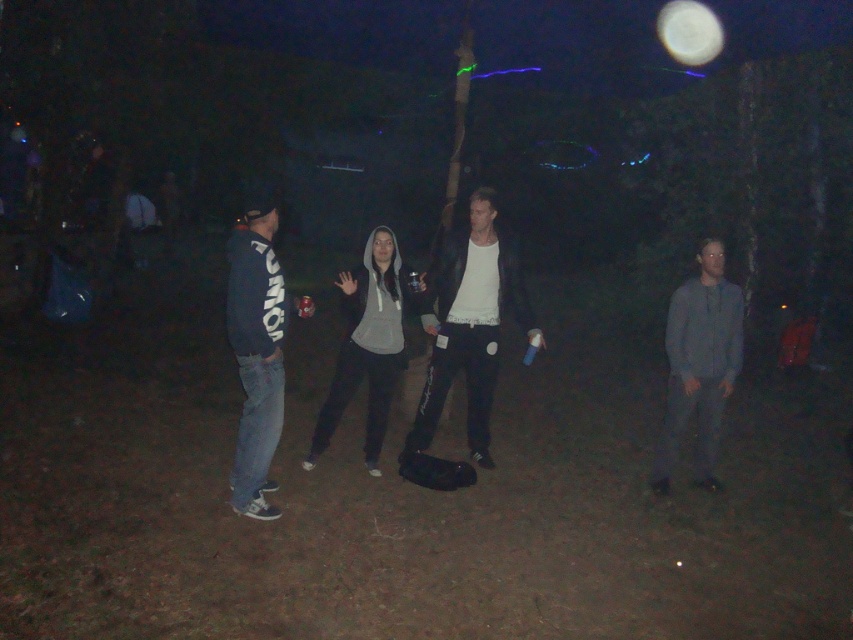
Question: Is the position of white matte jacket at center less distant than that of gray cotton shirt at right?

Choices:
 (A) yes
 (B) no

Answer: (B)

Question: Which point appears closest to the camera in this image?

Choices:
 (A) (680, 413)
 (B) (488, 228)
 (C) (392, 385)
 (D) (247, 502)

Answer: (D)

Question: Estimate the real-world distances between objects in this image. Which object is closer to the white matte jacket at center?

Choices:
 (A) dark blue hoodie at left
 (B) dark gray hoodie at center
 (C) gray cotton shirt at right

Answer: (B)

Question: Which of the following is the farthest from the observer?

Choices:
 (A) gray cotton shirt at right
 (B) dark gray hoodie at center
 (C) white matte jacket at center
 (D) dark blue hoodie at left

Answer: (C)

Question: Can you confirm if dark blue hoodie at left is bigger than dark gray hoodie at center?

Choices:
 (A) no
 (B) yes

Answer: (B)

Question: Does gray cotton shirt at right appear on the left side of dark gray hoodie at center?

Choices:
 (A) no
 (B) yes

Answer: (A)